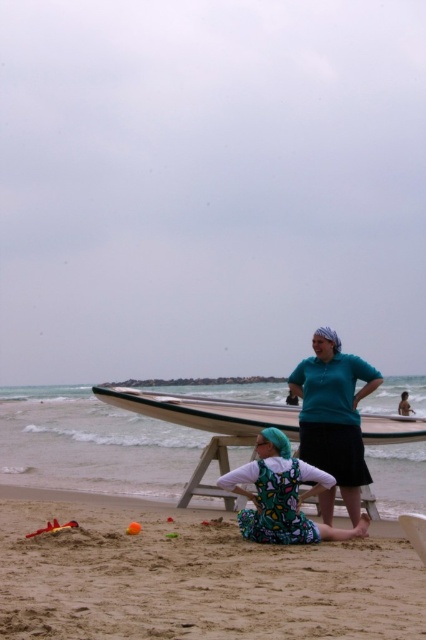
Question: Which object appears closest to the camera in this image?

Choices:
 (A) printed fabric swimsuit at center
 (B) white foam surfboard at center
 (C) teal matte shirt at center
 (D) wooden picnic table at center

Answer: (B)

Question: Does printed fabric swimsuit at center appear on the right side of green matte surfboard at center?

Choices:
 (A) no
 (B) yes

Answer: (B)

Question: Does green matte surfboard at center appear on the right side of wooden picnic table at center?

Choices:
 (A) no
 (B) yes

Answer: (B)

Question: Among these objects, which one is nearest to the camera?

Choices:
 (A) green matte surfboard at center
 (B) teal matte shirt at center
 (C) fine-grained sand at lower center
 (D) white foam surfboard at center

Answer: (D)

Question: Which of these objects is positioned farthest from the teal matte shirt at center?

Choices:
 (A) green matte surfboard at center
 (B) printed fabric swimsuit at center

Answer: (A)

Question: Observing the image, what is the correct spatial positioning of green matte surfboard at center in reference to wooden picnic table at center?

Choices:
 (A) right
 (B) left

Answer: (A)